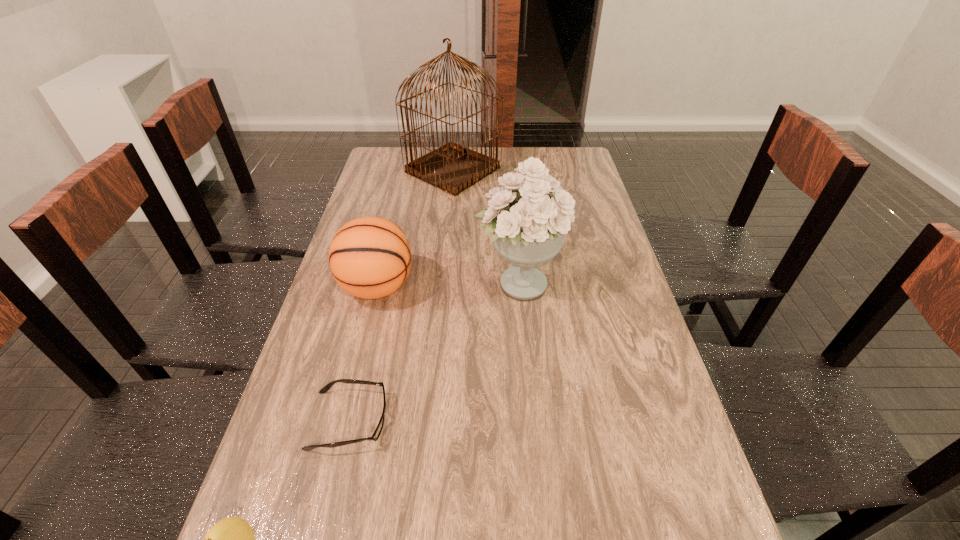
I want to click on object that is at the far edge, so click(x=453, y=168).

The width and height of the screenshot is (960, 540). In order to click on birdcage at the left edge in this screenshot , I will do `click(453, 168)`.

The image size is (960, 540). What are the coordinates of `basketball that is at the left edge` in the screenshot? It's located at (370, 257).

Image resolution: width=960 pixels, height=540 pixels. Find the location of `spectacles that is at the left edge`. spectacles that is at the left edge is located at coordinates (377, 432).

You are a GUI agent. You are given a task and a screenshot of the screen. Output one action in this format:
    pyautogui.click(x=<x>, y=<y>)
    Task: Click on the object located at the far left corner
    The width and height of the screenshot is (960, 540).
    Given the screenshot: What is the action you would take?
    pyautogui.click(x=453, y=168)

Locate an element on the screen. The height and width of the screenshot is (540, 960). blank space at the left edge of the desktop is located at coordinates (348, 318).

Find the location of `vacant region at the far right corner of the desktop`. vacant region at the far right corner of the desktop is located at coordinates (565, 177).

Find the location of a particular element. This screenshot has height=540, width=960. vacant space that is in between the spectacles and the birdcage is located at coordinates (401, 295).

I want to click on vacant area that lies between the shortest object and the birdcage, so [401, 295].

Where is `free space between the third shortest object and the fourth farthest object`? Image resolution: width=960 pixels, height=540 pixels. free space between the third shortest object and the fourth farthest object is located at coordinates (363, 354).